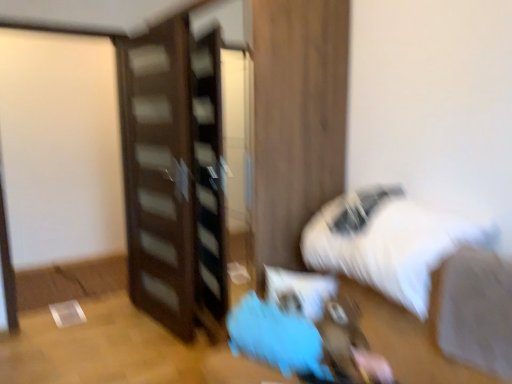
Question: Does white fluffy bed at lower right have a smaller size compared to dark wood dresser at center?

Choices:
 (A) yes
 (B) no

Answer: (A)

Question: Does white fluffy bed at lower right turn towards dark wood dresser at center?

Choices:
 (A) no
 (B) yes

Answer: (A)

Question: Is white fluffy bed at lower right closer to camera compared to dark wood dresser at center?

Choices:
 (A) yes
 (B) no

Answer: (A)

Question: Is white fluffy bed at lower right oriented away from dark wood dresser at center?

Choices:
 (A) yes
 (B) no

Answer: (B)

Question: Is white fluffy bed at lower right wider than dark wood dresser at center?

Choices:
 (A) yes
 (B) no

Answer: (B)

Question: Would you say dark wood dresser at center is part of white fluffy bed at lower right's contents?

Choices:
 (A) no
 (B) yes

Answer: (A)

Question: From the image's perspective, would you say dark wood dresser at center is shown under blue fabric bean bag at lower center?

Choices:
 (A) no
 (B) yes

Answer: (A)

Question: Does dark wood dresser at center touch blue fabric bean bag at lower center?

Choices:
 (A) no
 (B) yes

Answer: (A)

Question: Can you confirm if dark wood dresser at center is thinner than blue fabric bean bag at lower center?

Choices:
 (A) yes
 (B) no

Answer: (B)

Question: Considering the relative sizes of dark wood dresser at center and blue fabric bean bag at lower center in the image provided, is dark wood dresser at center shorter than blue fabric bean bag at lower center?

Choices:
 (A) yes
 (B) no

Answer: (B)

Question: Is dark wood dresser at center facing towards blue fabric bean bag at lower center?

Choices:
 (A) yes
 (B) no

Answer: (B)

Question: Considering the relative positions of dark wood dresser at center and blue fabric bean bag at lower center in the image provided, is dark wood dresser at center behind blue fabric bean bag at lower center?

Choices:
 (A) no
 (B) yes

Answer: (B)

Question: Considering the relative positions of white fluffy bed at lower right and white fabric at lower right in the image provided, is white fluffy bed at lower right to the right of white fabric at lower right from the viewer's perspective?

Choices:
 (A) yes
 (B) no

Answer: (B)